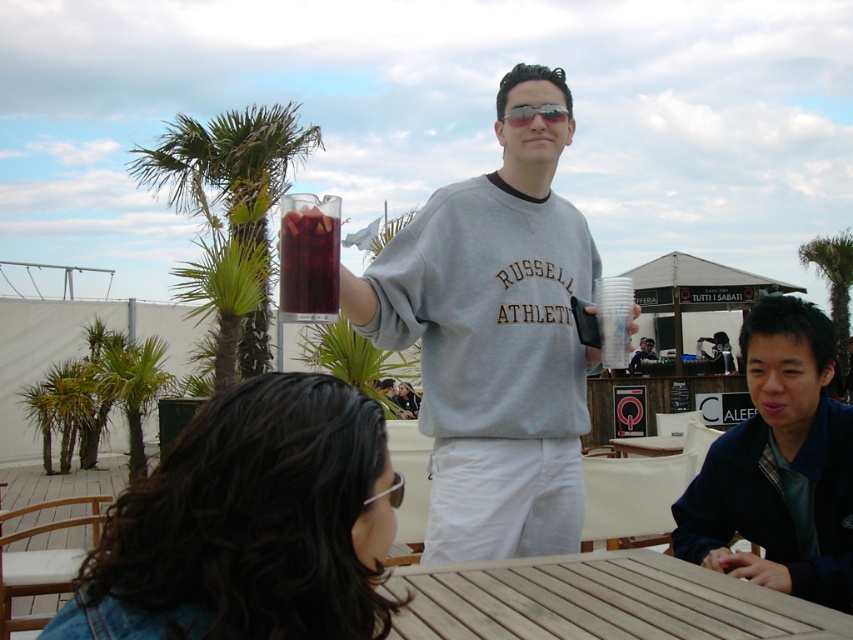
Question: From the image, what is the correct spatial relationship of green leafy palm tree at upper left in relation to sunglasses at center?

Choices:
 (A) left
 (B) right

Answer: (A)

Question: Which object appears closest to the camera in this image?

Choices:
 (A) dark blue jacket at lower right
 (B) matte gray sweatshirt at center
 (C) green leafy palm tree at center
 (D) clear plastic cup at upper center

Answer: (A)

Question: Does wooden table at lower center have a smaller size compared to clear plastic goggles at upper center?

Choices:
 (A) yes
 (B) no

Answer: (B)

Question: Which of these objects is positioned closest to the green leafy palm tree at upper left?

Choices:
 (A) dark blue jacket at lower right
 (B) matte gray sweatshirt at center

Answer: (A)

Question: Estimate the real-world distances between objects in this image. Which object is closer to the wooden table at lower center?

Choices:
 (A) green leafy palm tree at upper left
 (B) gray cotton sweatshirt at center

Answer: (B)

Question: Does gray cotton sweatshirt at center appear over clear plastic goggles at upper center?

Choices:
 (A) yes
 (B) no

Answer: (A)